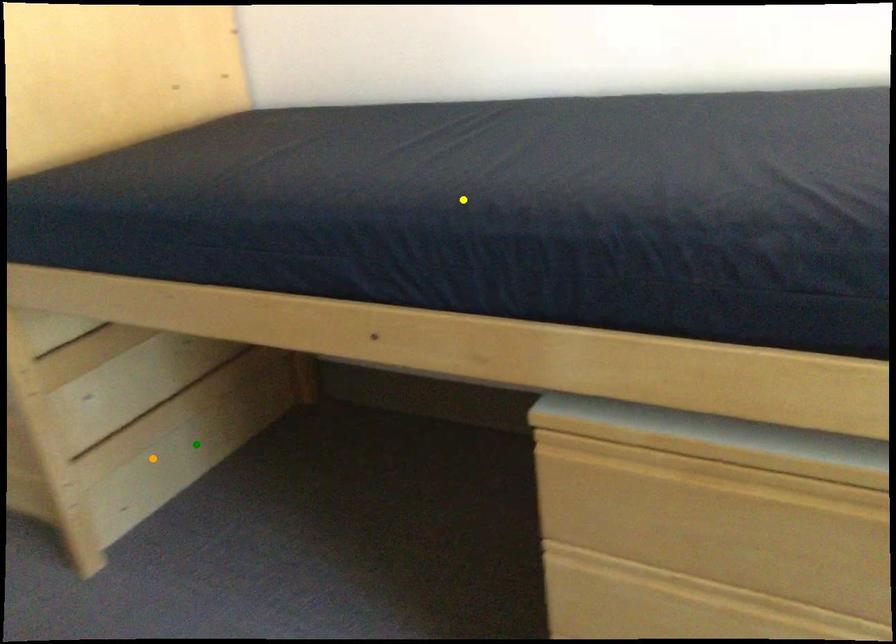
Order these from nearest to farthest:
- yellow point
- orange point
- green point

yellow point < orange point < green point